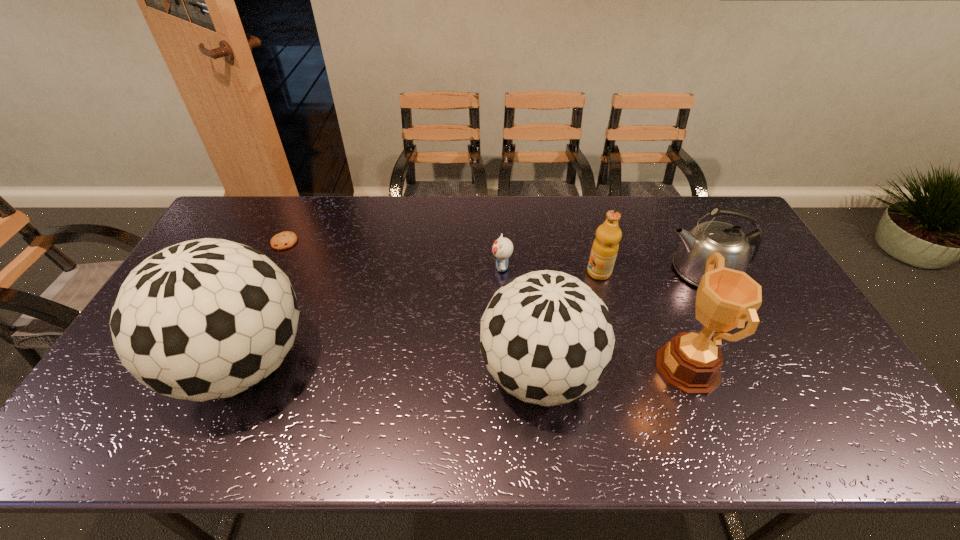
Locate an element on the screen. the left soccer ball is located at coordinates (205, 319).

You are a GUI agent. You are given a task and a screenshot of the screen. Output one action in this format:
    pyautogui.click(x=<x>, y=<y>)
    Task: Click on the shorter soccer ball
    This screenshot has height=540, width=960.
    Given the screenshot: What is the action you would take?
    pyautogui.click(x=546, y=337)

Find the location of `the shortest object`. the shortest object is located at coordinates (283, 240).

At what (x,y) coordinates should I click in order to perform the action: click on kettle. Please return your answer as a coordinate pair (x, y). Looking at the image, I should click on (739, 250).

This screenshot has height=540, width=960. I want to click on the sixth tallest object, so click(502, 248).

At what (x,y) coordinates should I click in order to perform the action: click on fruit juice. Please return your answer as a coordinate pair (x, y). The image size is (960, 540). Looking at the image, I should click on (605, 247).

What are the coordinates of `award` in the screenshot? It's located at (691, 362).

Where is `vacant space located 0.350m on the right of the taller soccer ball`? The height and width of the screenshot is (540, 960). vacant space located 0.350m on the right of the taller soccer ball is located at coordinates (446, 364).

Locate an element on the screen. This screenshot has height=540, width=960. free space located on the left of the shorter soccer ball is located at coordinates (356, 374).

The height and width of the screenshot is (540, 960). Identify the location of blank area located on the back of the cookie. (300, 210).